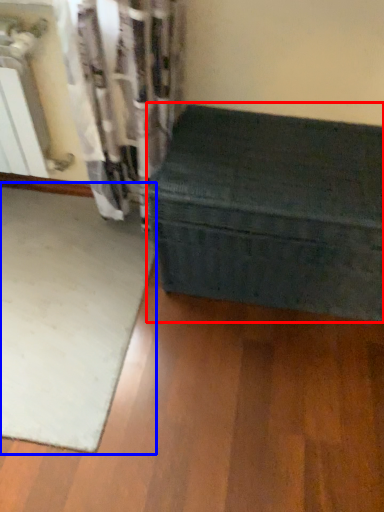
Question: Which object is closer to the camera taking this photo, furniture (highlighted by a red box) or mat (highlighted by a blue box)?

Choices:
 (A) furniture
 (B) mat

Answer: (A)